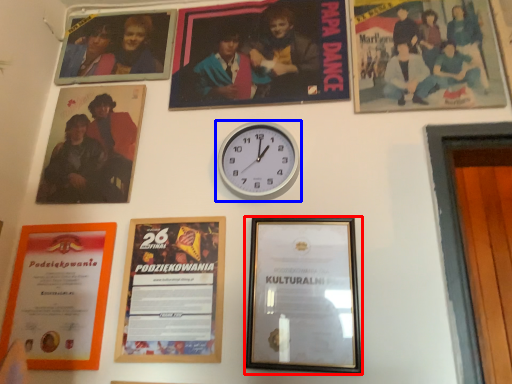
Question: Which point is closer to the camera, picture frame (highlighted by a red box) or wall clock (highlighted by a blue box)?

Choices:
 (A) picture frame
 (B) wall clock

Answer: (A)